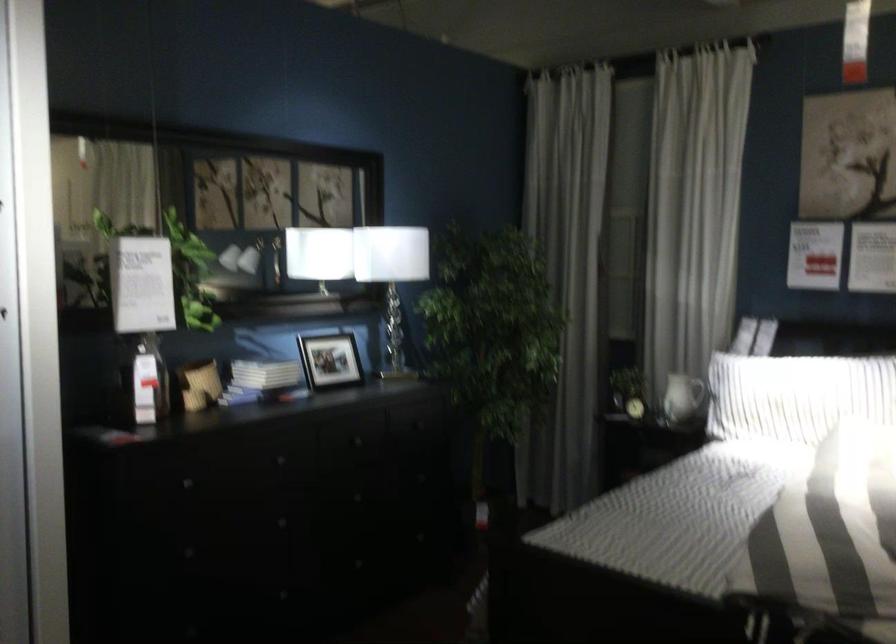
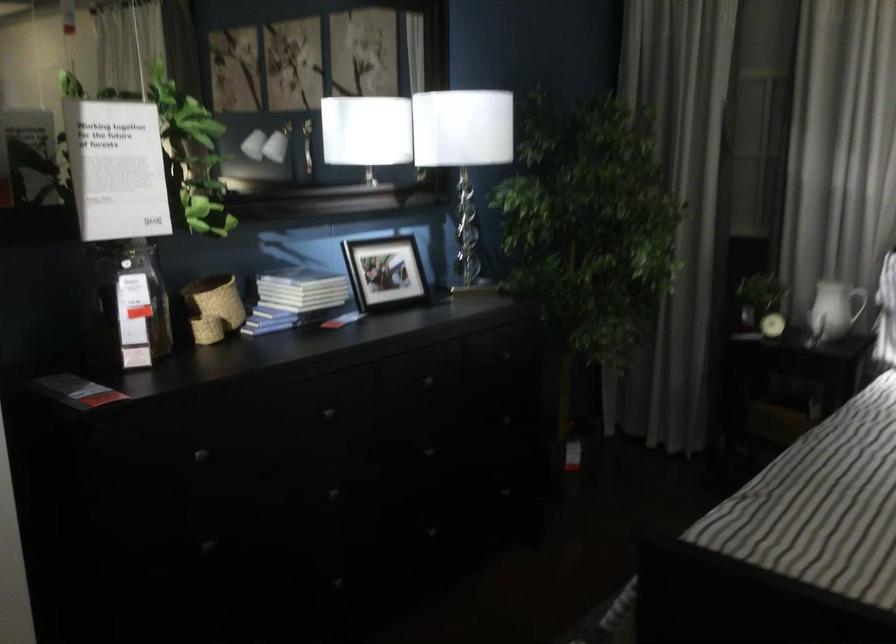
Find the pixel in the second image that matches point 264,373 in the first image.

(300, 290)